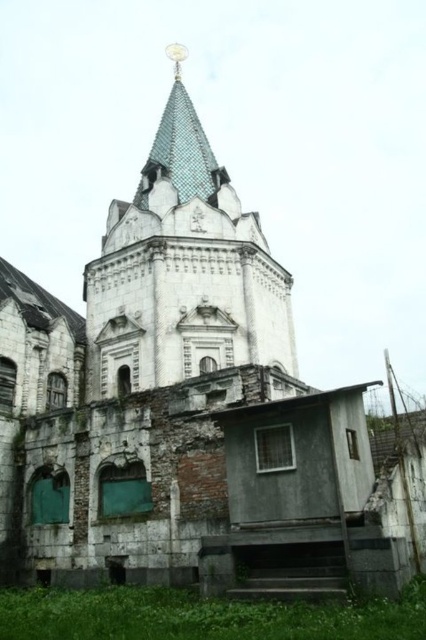
Question: Is white stone tower at center bigger than blue tiled spire at upper center?

Choices:
 (A) no
 (B) yes

Answer: (B)

Question: Is white stone tower at center thinner than blue tiled spire at upper center?

Choices:
 (A) yes
 (B) no

Answer: (B)

Question: Which point is farther from the camera taking this photo?

Choices:
 (A) (290, 330)
 (B) (176, 196)

Answer: (B)

Question: Does white stone tower at center lie in front of blue tiled spire at upper center?

Choices:
 (A) yes
 (B) no

Answer: (A)